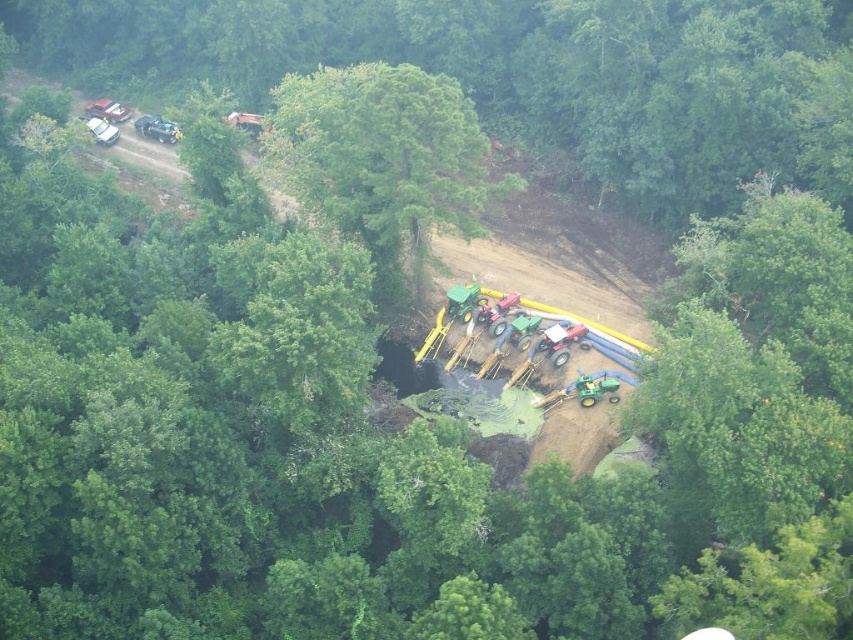
You are a drone operator flying over a construction site in a forest. You notice two green leafy trees in the image. One is labeled as green leafy tree at upper center and the other as green leafy tree at center. From your aerial view, which tree is positioned higher up in the image?

The green leafy tree at upper center is positioned higher up in the image compared to the green leafy tree at center.